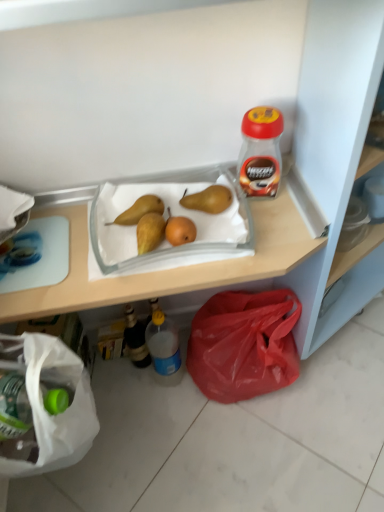
This screenshot has height=512, width=384. What are the coordinates of `vacant area that is in front of yellow matte pear at center, which ranks as the second pear in right-to-left order` in the screenshot? It's located at (x=124, y=257).